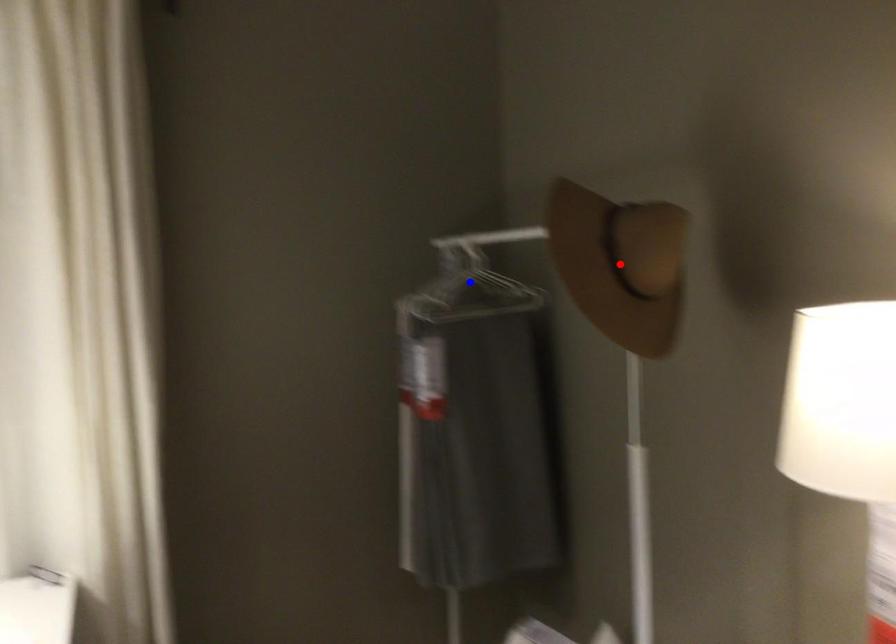
Question: In the image, two points are highlighted. Which point is nearer to the camera? Reply with the corresponding letter.

Choices:
 (A) blue point
 (B) red point

Answer: (B)